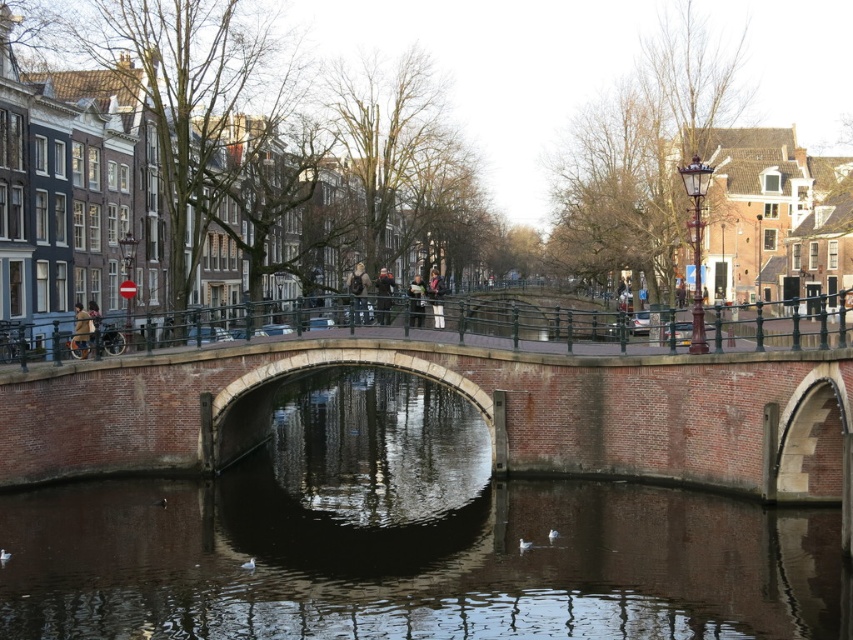
Question: Which of the following is the closest to the observer?

Choices:
 (A) green metal railing at center
 (B) brick stone bridge at center

Answer: (B)

Question: In this image, where is brick stone bridge at center located relative to green metal railing at center?

Choices:
 (A) above
 (B) below

Answer: (B)

Question: Is brick stone bridge at center positioned in front of green metal railing at center?

Choices:
 (A) no
 (B) yes

Answer: (B)

Question: Does brick stone bridge at center have a lesser width compared to green metal railing at center?

Choices:
 (A) no
 (B) yes

Answer: (B)